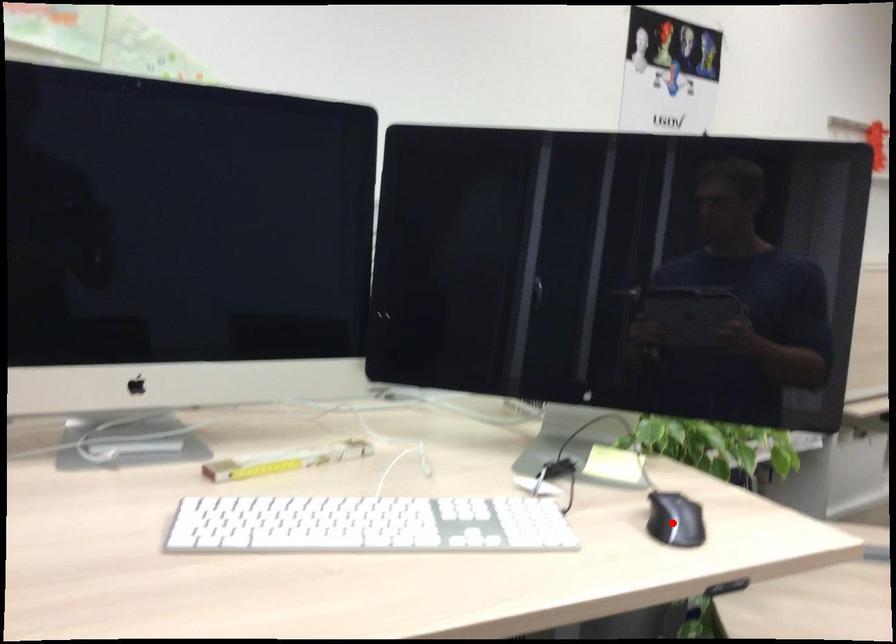
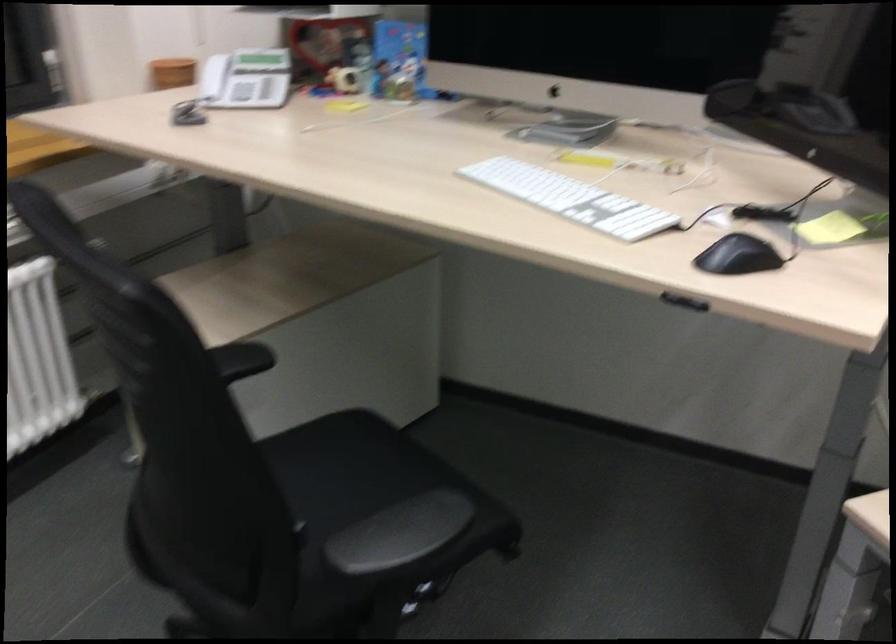
Find the pixel in the second image that matches the highlighted location in the first image.

(737, 256)